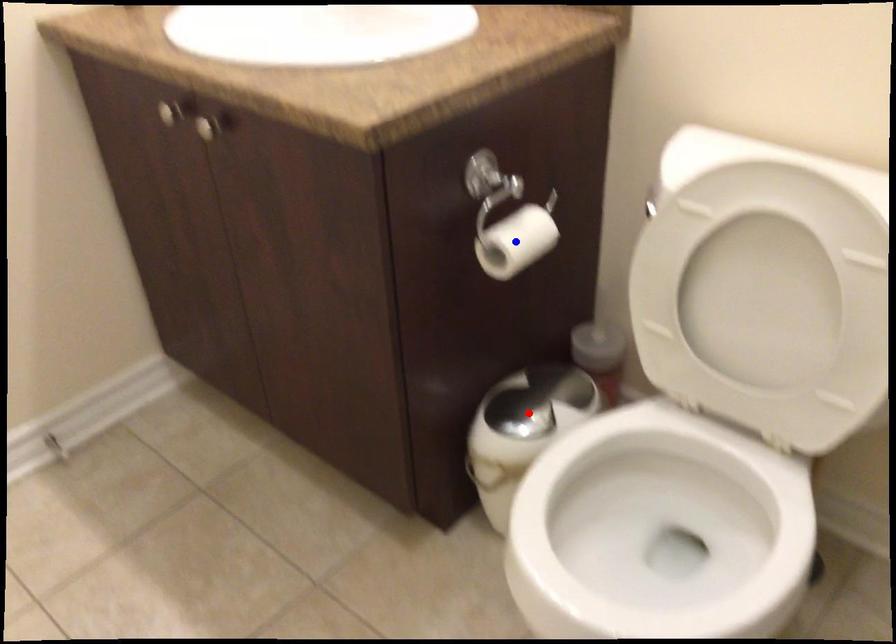
Question: Which of the two points in the image is closer to the camera?

Choices:
 (A) Blue point is closer.
 (B) Red point is closer.

Answer: (A)